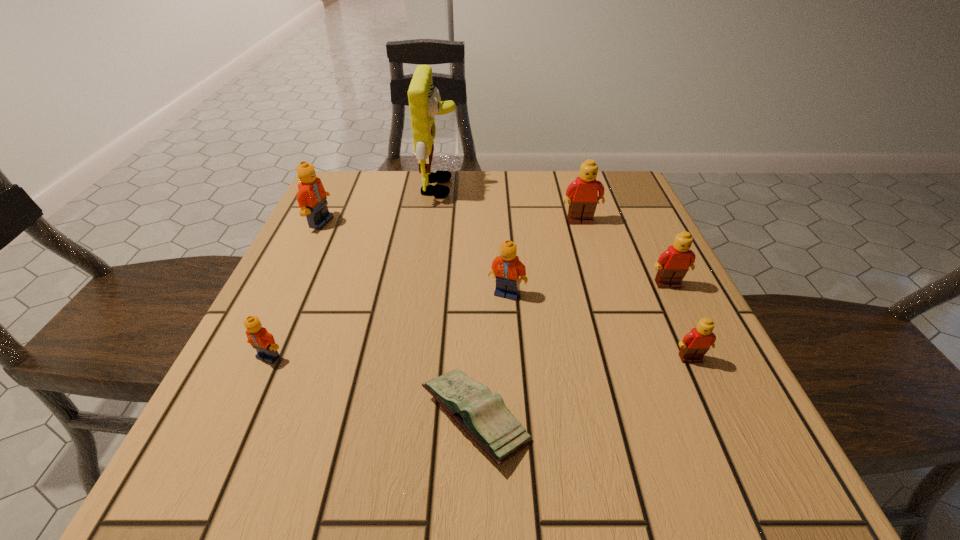
Identify the location of free location that satisfies the following two spatial constraints: 1. on the face of the fourth Lego from left to right; 2. on the front-facing side of the farthest orange Lego. (581, 222).